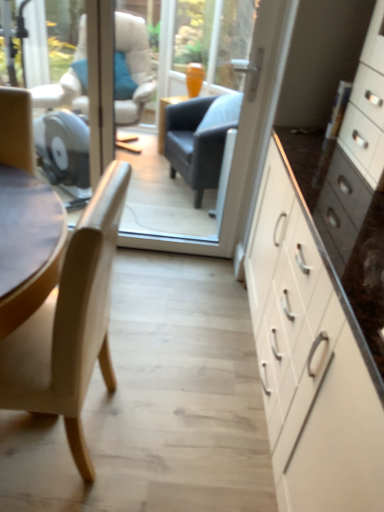
Question: From a real-world perspective, is light beige wood chair at left physically below transparent glass door at center?

Choices:
 (A) no
 (B) yes

Answer: (B)

Question: Does light beige wood chair at left have a larger size compared to transparent glass door at center?

Choices:
 (A) no
 (B) yes

Answer: (B)

Question: From the image's perspective, is light beige wood chair at left located above transparent glass door at center?

Choices:
 (A) no
 (B) yes

Answer: (A)

Question: Considering the relative sizes of light beige wood chair at left and transparent glass door at center in the image provided, is light beige wood chair at left wider than transparent glass door at center?

Choices:
 (A) no
 (B) yes

Answer: (B)

Question: Is light beige wood chair at left thinner than transparent glass door at center?

Choices:
 (A) yes
 (B) no

Answer: (B)

Question: Is light beige wood chair at left surrounding transparent glass door at center?

Choices:
 (A) no
 (B) yes

Answer: (A)

Question: Does white glossy cabinet at right have a larger size compared to transparent glass door at center?

Choices:
 (A) yes
 (B) no

Answer: (A)

Question: From a real-world perspective, does white glossy cabinet at right sit lower than transparent glass door at center?

Choices:
 (A) yes
 (B) no

Answer: (B)

Question: Is white glossy cabinet at right positioned beyond the bounds of transparent glass door at center?

Choices:
 (A) no
 (B) yes

Answer: (B)

Question: From the image's perspective, does white glossy cabinet at right appear lower than transparent glass door at center?

Choices:
 (A) no
 (B) yes

Answer: (B)

Question: Is white glossy cabinet at right at the right side of transparent glass door at center?

Choices:
 (A) no
 (B) yes

Answer: (B)

Question: Could you tell me if white glossy cabinet at right is turned towards transparent glass door at center?

Choices:
 (A) no
 (B) yes

Answer: (B)

Question: Considering the relative sizes of light beige wood chair at left and white glossy cabinet at right in the image provided, is light beige wood chair at left thinner than white glossy cabinet at right?

Choices:
 (A) yes
 (B) no

Answer: (A)